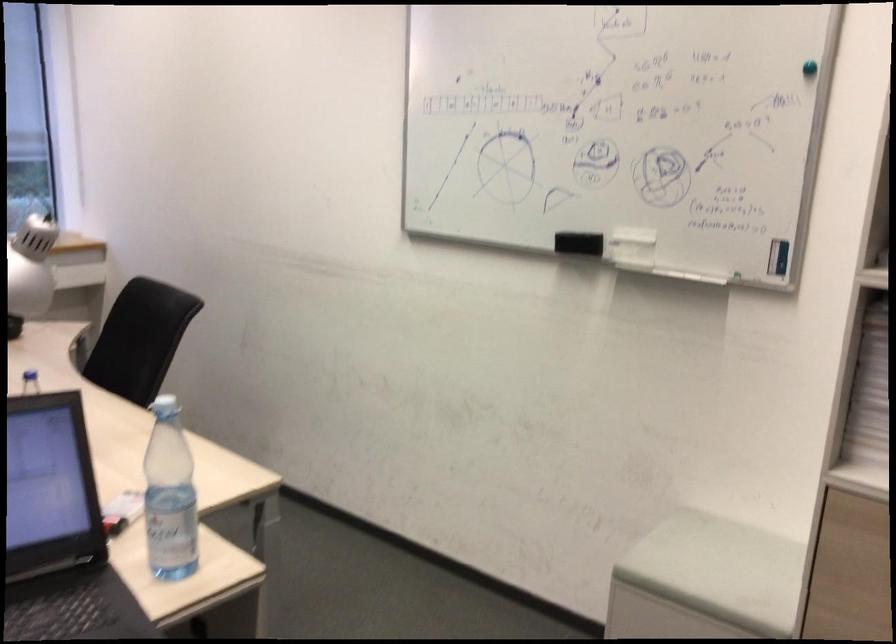
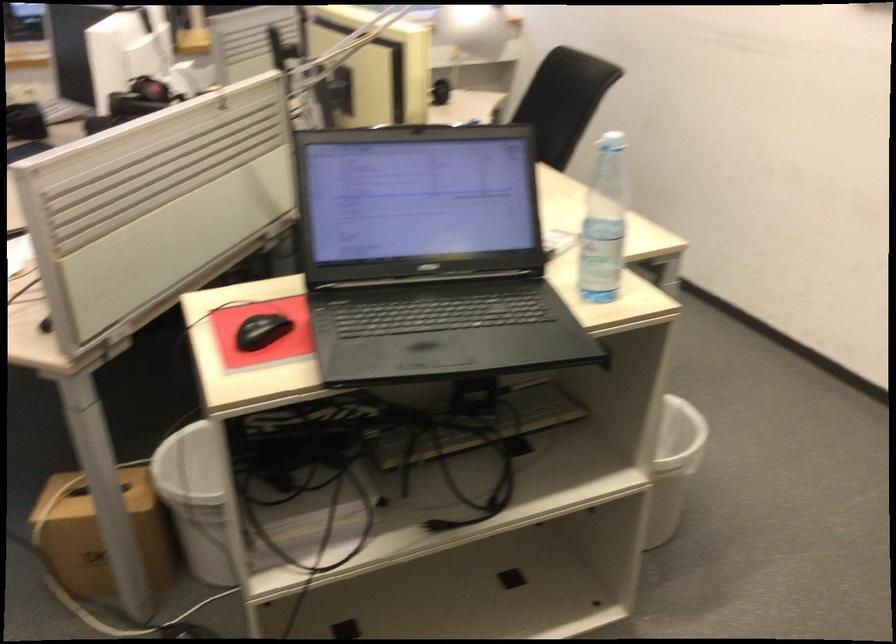
Find the pixel in the second image that matches point (169, 412) in the first image.

(612, 142)